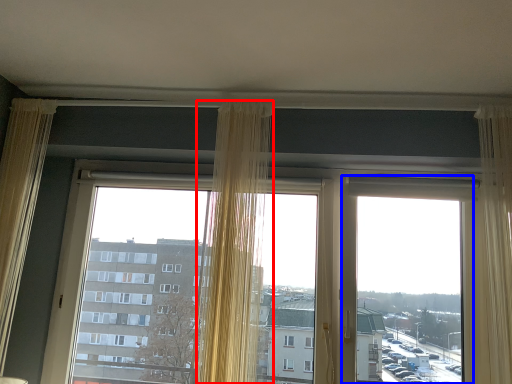
Question: Which object is further to the camera taking this photo, curtain (highlighted by a red box) or window screen (highlighted by a blue box)?

Choices:
 (A) curtain
 (B) window screen

Answer: (B)